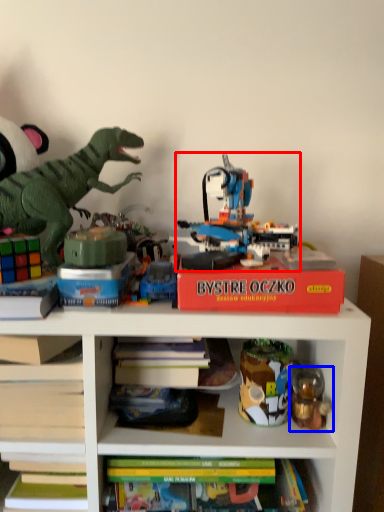
Question: Which object appears closest to the camera in this image, toy (highlighted by a red box) or toy (highlighted by a blue box)?

Choices:
 (A) toy
 (B) toy

Answer: (B)